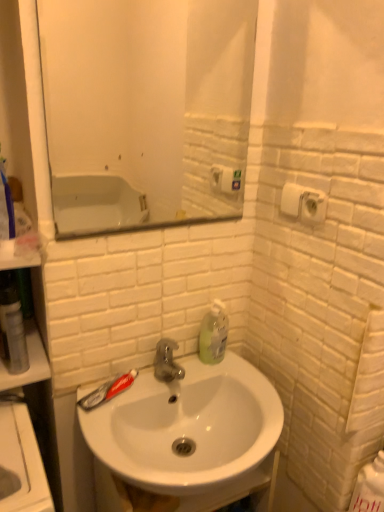
What are the coordinates of `vacant space to the left of translucent plastic soap dispenser at upper right` in the screenshot? It's located at (182, 370).